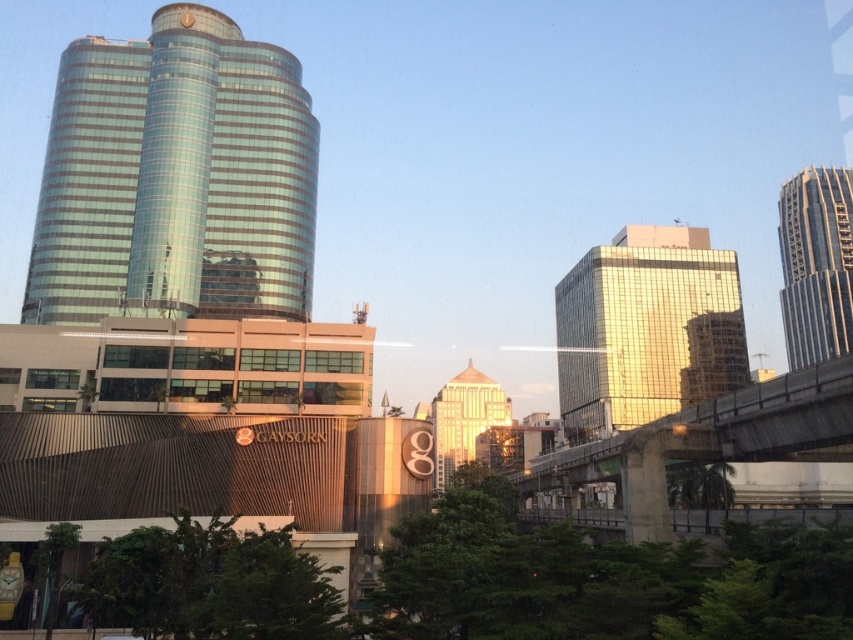
You are a drone operator who needs to fly a drone between the glossy glass building at center and the glassy metallic skyscraper at right. The drone has a maximum flight distance of 50 meters. Can the drone safely fly between them without exceeding its range?

The glossy glass building at center is 46.58 meters away from the glassy metallic skyscraper at right. Since the distance is less than the drone maximum flight distance of 50 meters, the drone can safely fly between them without exceeding its range.

You are a photographer standing in the middle of the street, aiming to capture both the glossy glass building at center and the concrete bridge at right in a single shot. Based on their positions, which object will appear larger in your photo?

The glossy glass building at center will appear larger in the photo because it is closer to the photographer than the concrete bridge at right.